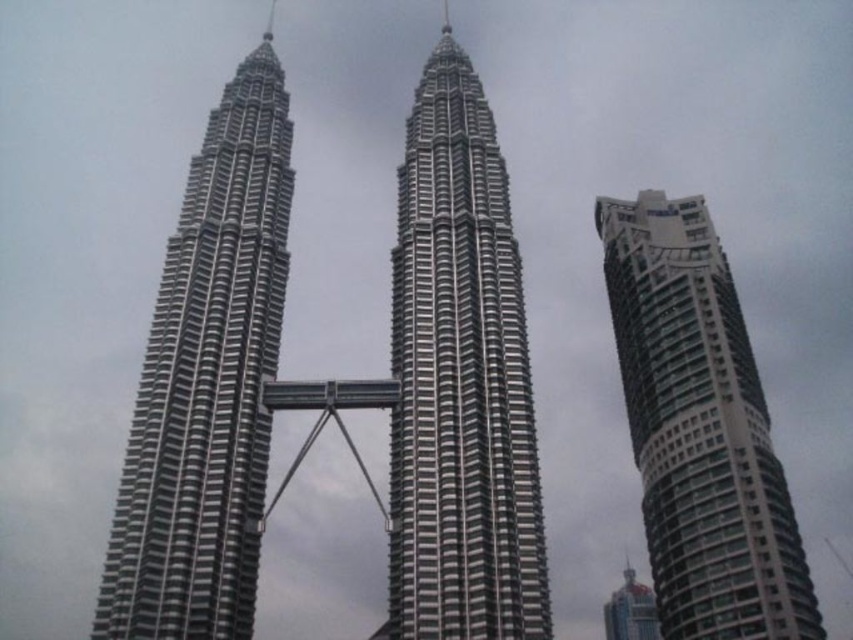
Based on the provided coordinates, which iconic structure does the point at (207,381) correspond to in the image?

The point at (207,381) corresponds to the silver metallic twin towers at center, which are the Petronas Twin Towers in Kuala Lumpur, Malaysia.

Looking at this image, you are a drone operator planning to fly a drone between the silver metallic building at center and the other high rise to the right. The drone has a maximum flight distance of 60 meters. Can the drone safely make the trip without exceeding its range limit?

The distance between the silver metallic building at center and the other high rise is 61.47 meters, which exceeds the drone operator maximum flight range of 60 meters. The drone cannot safely make the trip without exceeding its range limit.

You are a drone operator who needs to fly a drone between the silver metallic twin towers at center and the shiny blue glass skyscraper at lower right. The drone has a maximum flight distance of 85 meters. Can the drone safely make the trip between them without exceeding its range?

The silver metallic twin towers at center is 86.53 meters from the shiny blue glass skyscraper at lower right. Since the distance is greater than the drone maximum flight distance of 85 meters, the drone cannot safely make the trip between them without exceeding its range.